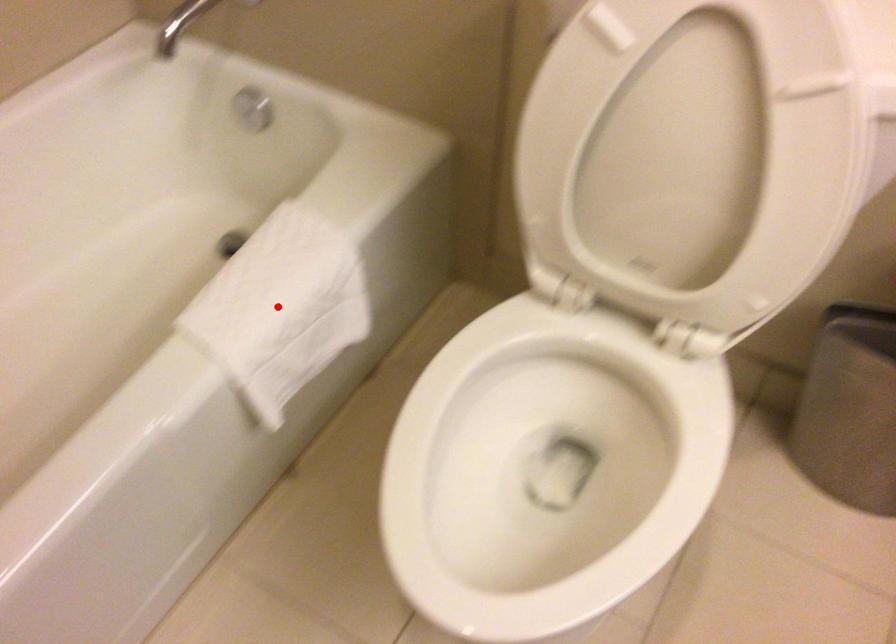
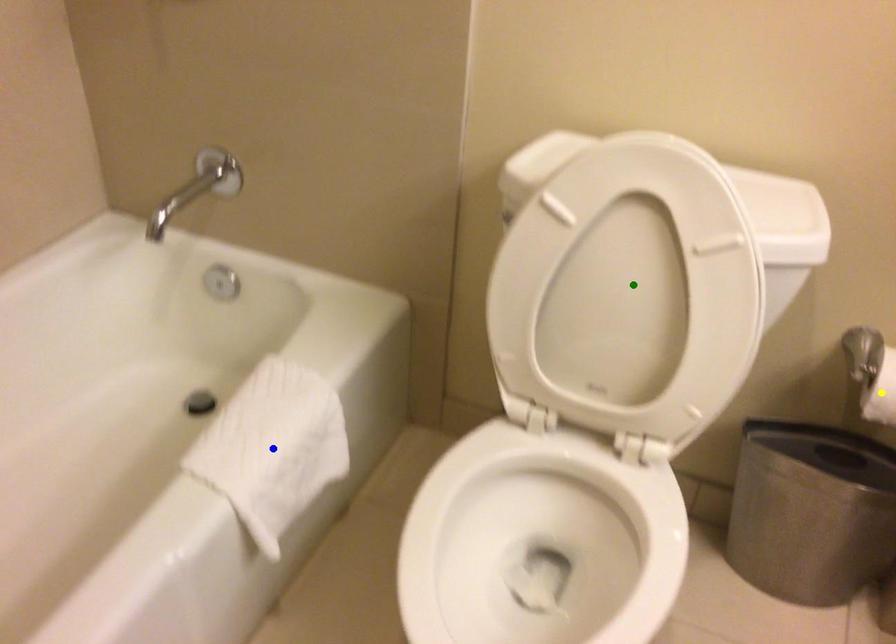
Question: I am providing you with two images of the same scene from different viewpoints. A red point is marked on the first image. You are given multiple points on the second image. Which point in image 2 represents the same 3d spot as the red point in image 1?

Choices:
 (A) yellow point
 (B) blue point
 (C) green point

Answer: (B)